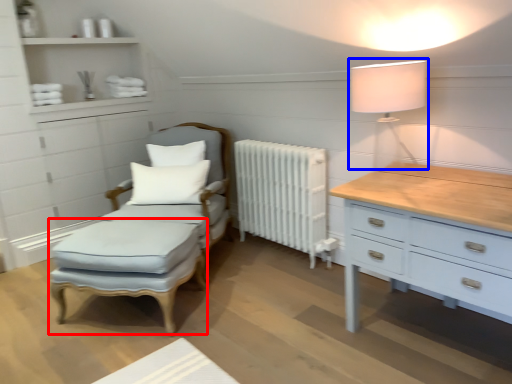
Question: Which object appears closest to the camera in this image, footrest (highlighted by a red box) or table lamp (highlighted by a blue box)?

Choices:
 (A) footrest
 (B) table lamp

Answer: (B)